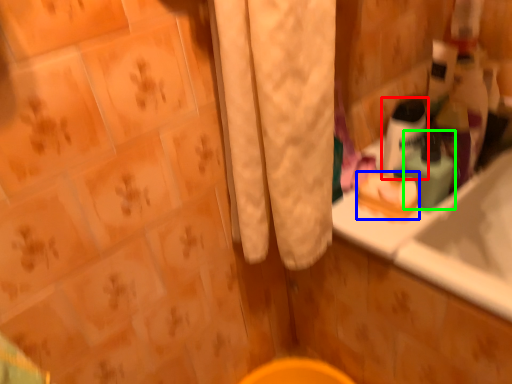
Question: Based on their relative distances, which object is nearer to mouthwash (highlighted by a red box)? Choose from soap (highlighted by a blue box) and mouthwash (highlighted by a green box).

Choices:
 (A) soap
 (B) mouthwash

Answer: (B)